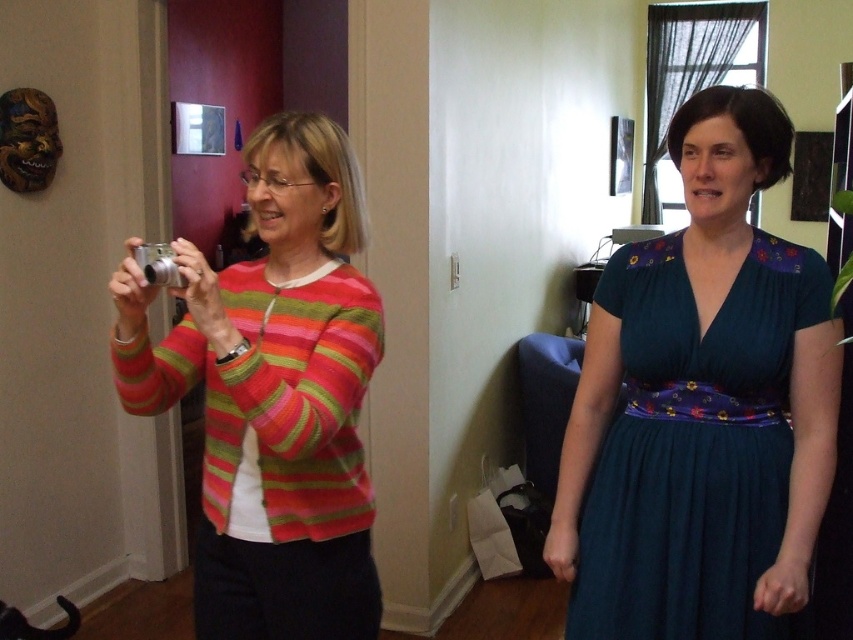
Does striped knit sweater at left appear under silver metallic camera at left?

Correct, striped knit sweater at left is located below silver metallic camera at left.

Between striped knit sweater at left and silver metallic camera at left, which one appears on the right side from the viewer's perspective?

striped knit sweater at left is more to the right.

What do you see at coordinates (273, 394) in the screenshot? I see `striped knit sweater at left` at bounding box center [273, 394].

I want to click on striped knit sweater at left, so click(x=273, y=394).

Does dark blue satin dress at center have a smaller size compared to silver metallic camera at left?

Actually, dark blue satin dress at center might be larger than silver metallic camera at left.

The height and width of the screenshot is (640, 853). Identify the location of dark blue satin dress at center. (694, 445).

Between striped knit sweater at left and dark blue satin dress at center, which one appears on the left side from the viewer's perspective?

striped knit sweater at left is more to the left.

Does striped knit sweater at left appear over dark blue satin dress at center?

Yes, striped knit sweater at left is above dark blue satin dress at center.

Who is more forward, (366, 632) or (666, 634)?

Positioned in front is point (666, 634).

Find the location of `striped knit sweater at left`. striped knit sweater at left is located at coordinates (273, 394).